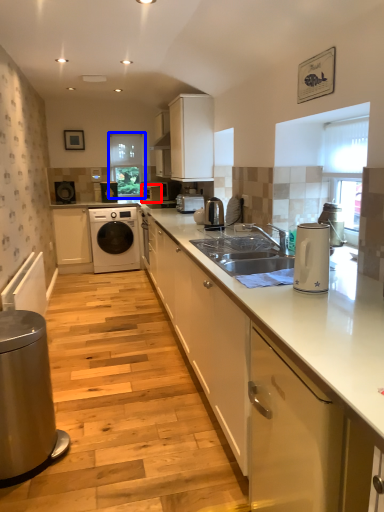
Question: Among these objects, which one is nearest to the camera, appliance (highlighted by a red box) or window screen (highlighted by a blue box)?

Choices:
 (A) appliance
 (B) window screen

Answer: (A)